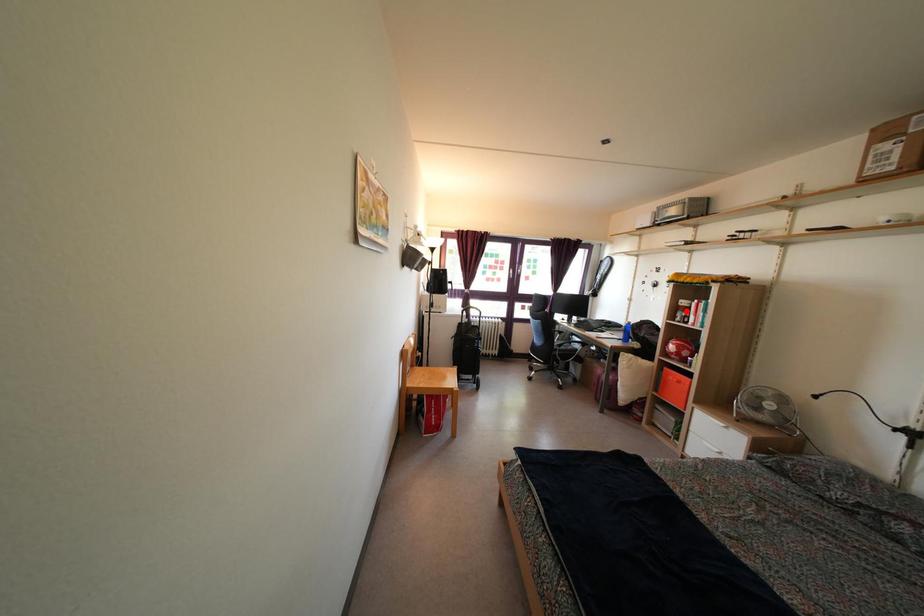
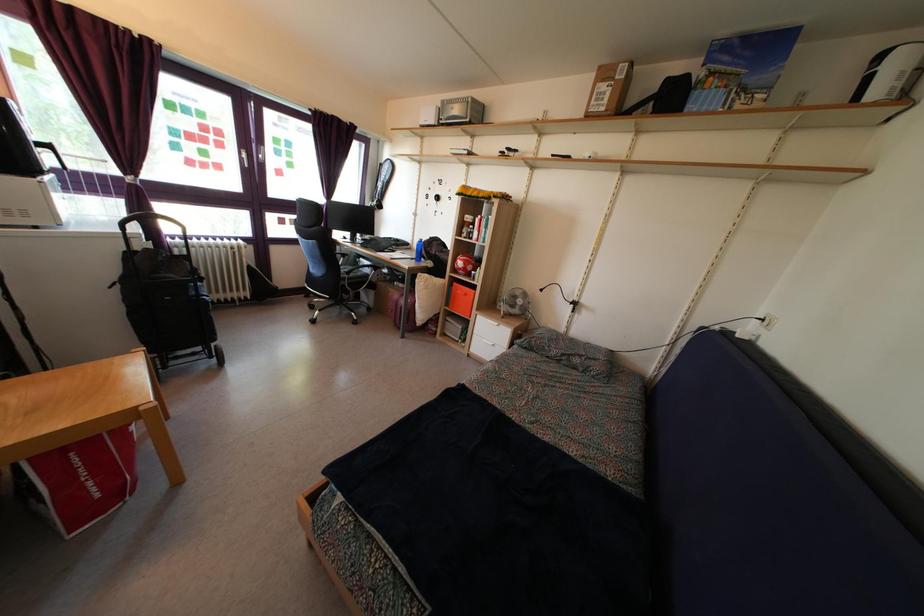
Question: I am providing you with two images of the same scene from different viewpoints. A red point is shown in image1. For the corresponding object point in image2, is it positioned nearer or farther from the camera?

Choices:
 (A) Nearer
 (B) Farther

Answer: (A)